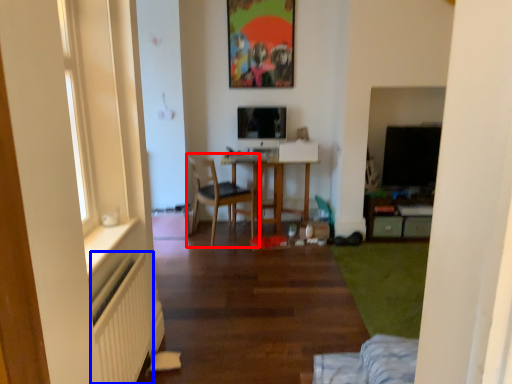
Question: Which point is closer to the camera, chair (highlighted by a red box) or radiator (highlighted by a blue box)?

Choices:
 (A) chair
 (B) radiator

Answer: (B)